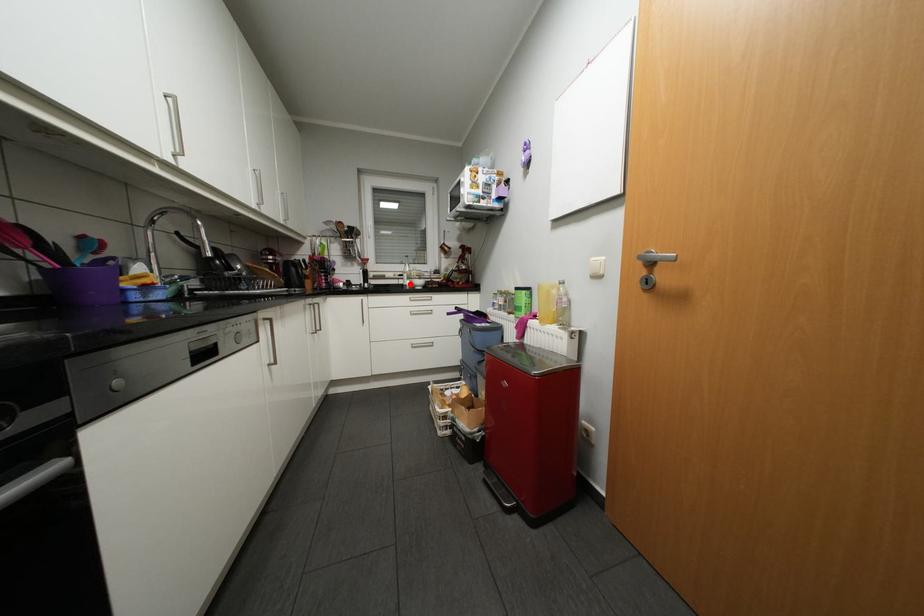
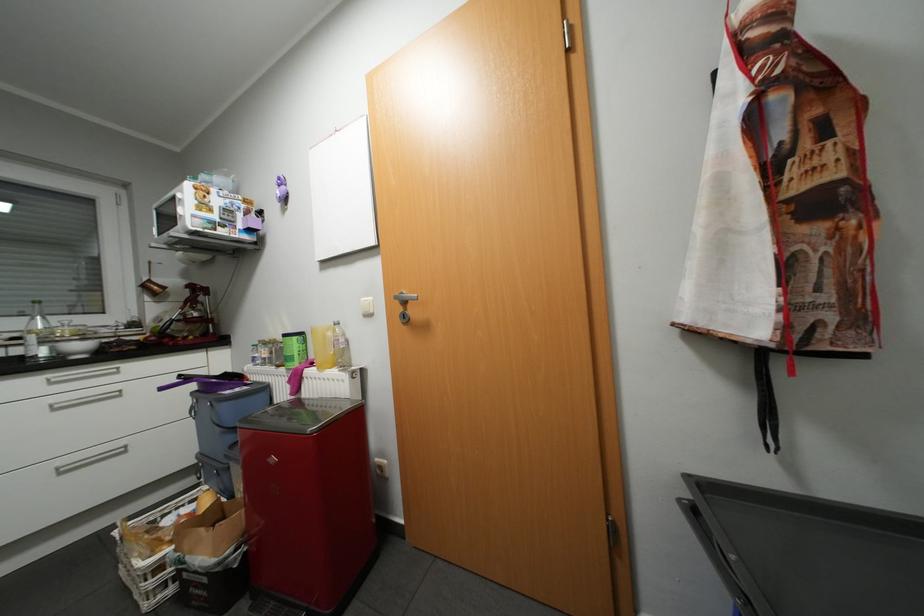
In the second image, find the point that corresponds to the highlighted location in the first image.

(30, 357)